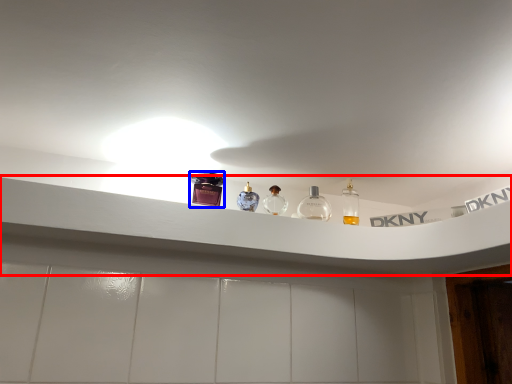
Question: Which object appears closest to the camera in this image, window sill (highlighted by a red box) or toiletry (highlighted by a blue box)?

Choices:
 (A) window sill
 (B) toiletry

Answer: (A)